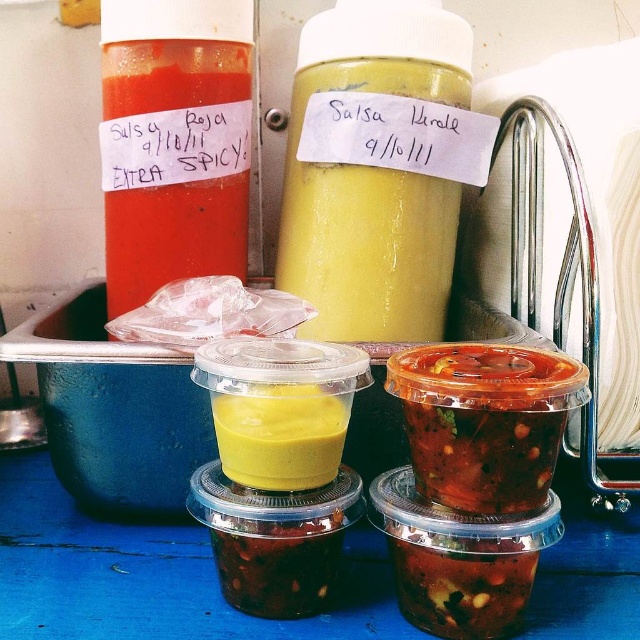
Between point (300, 177) and point (243, 83), which one is positioned in front?

Point (243, 83) is more forward.

Which is behind, point (358, 172) or point (125, 236)?

Positioned behind is point (125, 236).

The height and width of the screenshot is (640, 640). Find the location of `yellow translucent jar at center`. yellow translucent jar at center is located at coordinates (369, 218).

Can you confirm if matte plastic bottle at upper left is thinner than dark red glossy sauce at center?

In fact, matte plastic bottle at upper left might be wider than dark red glossy sauce at center.

Locate an element on the screen. Image resolution: width=640 pixels, height=640 pixels. matte plastic bottle at upper left is located at coordinates (173, 164).

Which is below, yellow matte plastic cup at center or dark red glossy sauce at center?

dark red glossy sauce at center is below.

Based on the photo, is yellow matte plastic cup at center bigger than dark red glossy sauce at center?

Correct, yellow matte plastic cup at center is larger in size than dark red glossy sauce at center.

Between point (301, 464) and point (340, 538), which one is positioned in front?

Positioned in front is point (301, 464).

Image resolution: width=640 pixels, height=640 pixels. Find the location of `yellow matte plastic cup at center`. yellow matte plastic cup at center is located at coordinates (280, 436).